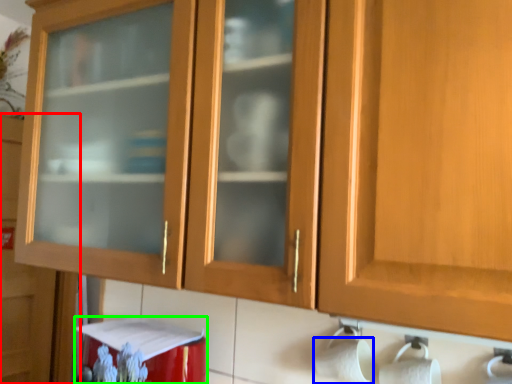
Question: Which object is the farthest from cupboard (highlighted by a red box)? Choose among these: toilet paper (highlighted by a blue box) or appliance (highlighted by a green box).

Choices:
 (A) toilet paper
 (B) appliance

Answer: (A)